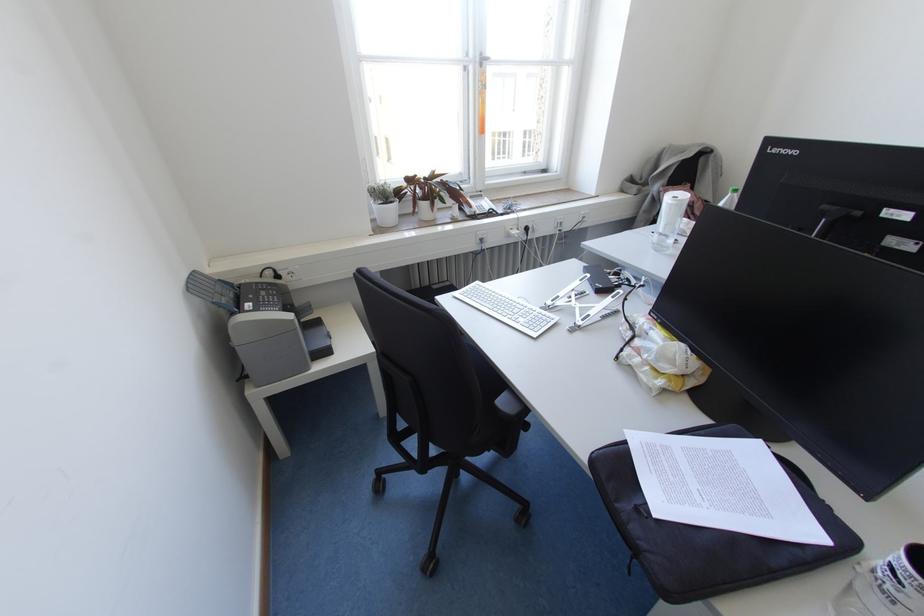
Image resolution: width=924 pixels, height=616 pixels. Find the location of `paper towel roll`. paper towel roll is located at coordinates (671, 211).